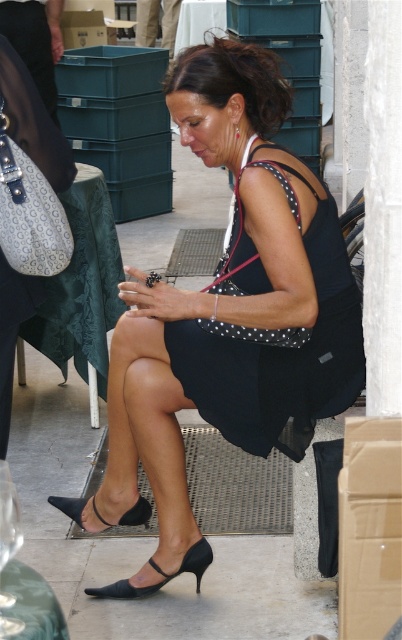
Question: Can you confirm if black dotted dress at center is positioned to the left of black leather high-heeled sandal at lower center?

Choices:
 (A) no
 (B) yes

Answer: (A)

Question: Among these points, which one is farthest from the camera?

Choices:
 (A) (102, 595)
 (B) (235, 157)
 (C) (143, 522)
 (D) (180, 358)

Answer: (C)

Question: Which object is positioned closest to the black dotted fabric dress at center?

Choices:
 (A) black leather high-heeled sandal at lower center
 (B) black dotted dress at center

Answer: (B)

Question: Is black dotted fabric dress at center above black leather sandal at lower center?

Choices:
 (A) yes
 (B) no

Answer: (A)

Question: Can you confirm if black dotted dress at center is thinner than black leather sandal at lower center?

Choices:
 (A) no
 (B) yes

Answer: (A)

Question: Among these objects, which one is farthest from the camera?

Choices:
 (A) black dotted fabric dress at center
 (B) black dotted dress at center
 (C) black leather high-heeled sandal at lower center

Answer: (C)